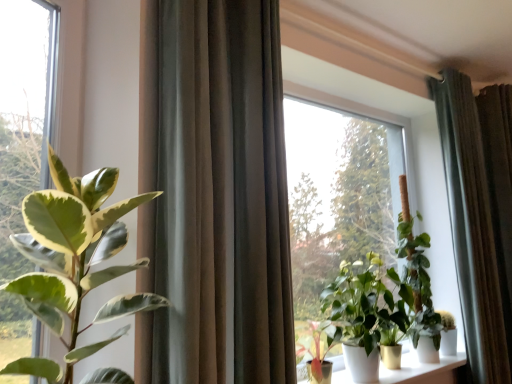
Question: Which direction should I rotate to look at satin brown curtain at center, which is counted as the second curtain, starting from the right, — up or down?

Choices:
 (A) up
 (B) down

Answer: (A)

Question: In which direction should I rotate to look at green glossy plant at center, acting as the second houseplant starting from the right?

Choices:
 (A) left
 (B) right

Answer: (B)

Question: From the image's perspective, does green leafy plant at left appear higher than white glossy pots at lower center?

Choices:
 (A) no
 (B) yes

Answer: (B)

Question: Can you confirm if green leafy plant at left is positioned to the right of white glossy pots at lower center?

Choices:
 (A) no
 (B) yes

Answer: (A)

Question: Is green leafy plant at left thinner than white glossy pots at lower center?

Choices:
 (A) yes
 (B) no

Answer: (A)

Question: Would you consider green leafy plant at left to be distant from white glossy pots at lower center?

Choices:
 (A) no
 (B) yes

Answer: (B)

Question: Is green leafy plant at left further to camera compared to white glossy pots at lower center?

Choices:
 (A) no
 (B) yes

Answer: (A)

Question: Would you say green leafy plant at left is outside white glossy pots at lower center?

Choices:
 (A) no
 (B) yes

Answer: (B)

Question: Is green leafy plant at left to the right of satin brown curtain at center, positioned as the 1th curtain in left-to-right order, from the viewer's perspective?

Choices:
 (A) no
 (B) yes

Answer: (A)

Question: From the image's perspective, is green leafy plant at left on top of satin brown curtain at center, the 2th curtain from the back?

Choices:
 (A) no
 (B) yes

Answer: (A)

Question: Does green leafy plant at left have a greater width compared to satin brown curtain at center, the 2th curtain from the back?

Choices:
 (A) yes
 (B) no

Answer: (B)

Question: Considering the relative sizes of green leafy plant at left and satin brown curtain at center, the 1th curtain in the front-to-back sequence, in the image provided, is green leafy plant at left thinner than satin brown curtain at center, the 1th curtain in the front-to-back sequence,?

Choices:
 (A) yes
 (B) no

Answer: (A)

Question: From a real-world perspective, is green leafy plant at left located higher than satin brown curtain at center, the 1th curtain in the front-to-back sequence?

Choices:
 (A) yes
 (B) no

Answer: (B)

Question: Does green leafy plant at left have a larger size compared to satin brown curtain at center, which is counted as the second curtain, starting from the right?

Choices:
 (A) no
 (B) yes

Answer: (A)

Question: From a real-world perspective, is green matte plant at center, the third houseplant when ordered from back to front, located higher than green matte plant at center, the 1th houseplant viewed from the back?

Choices:
 (A) yes
 (B) no

Answer: (B)